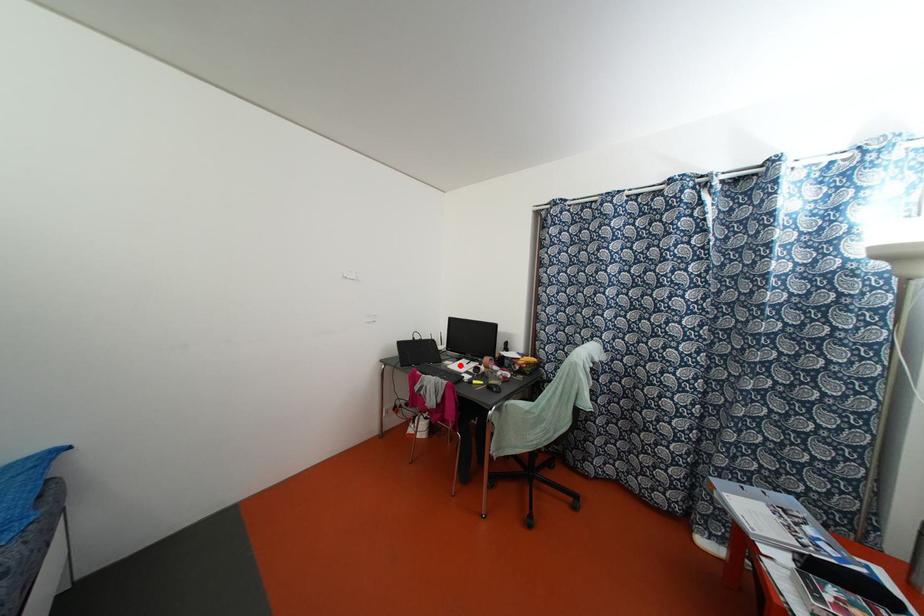
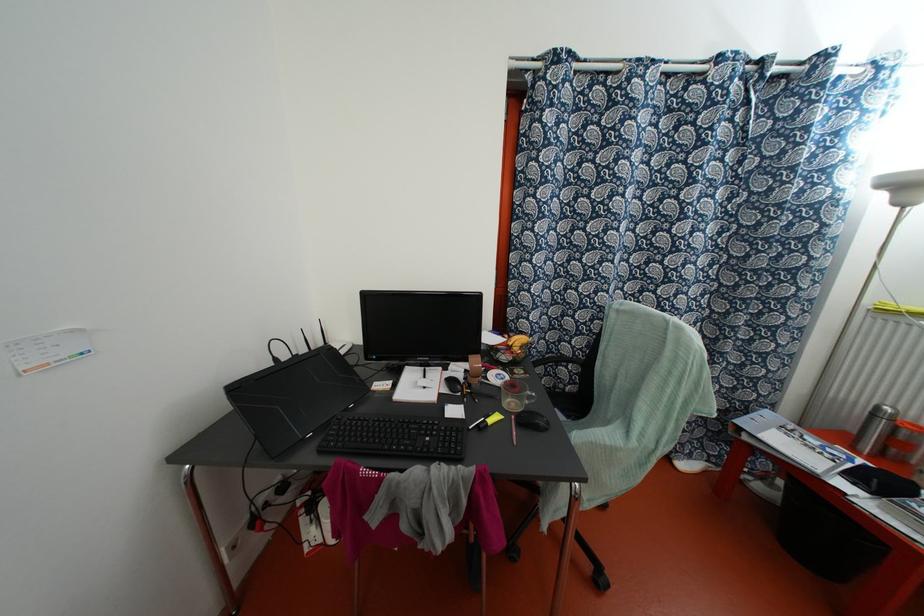
Find the pixel in the second image that matches the highlighted location in the first image.

(418, 386)